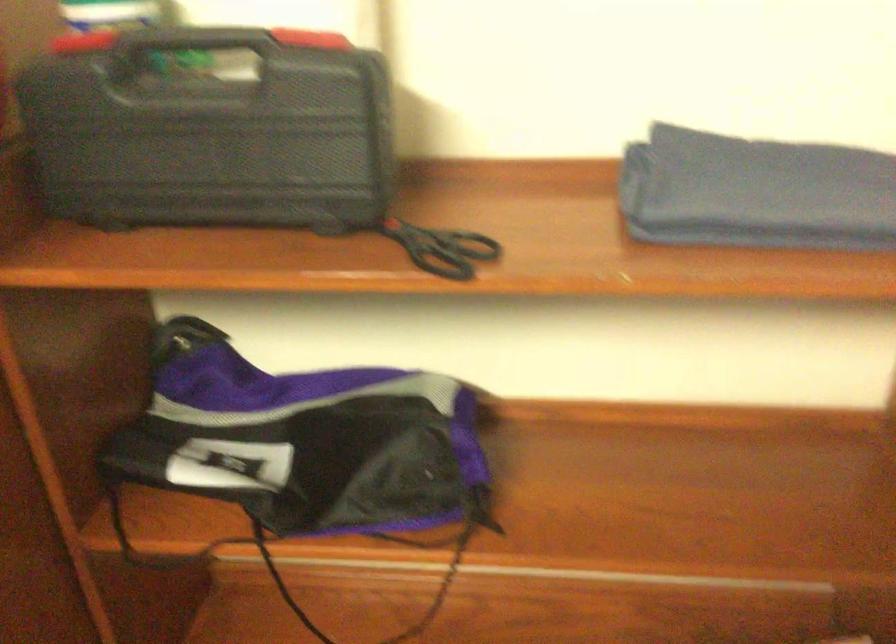
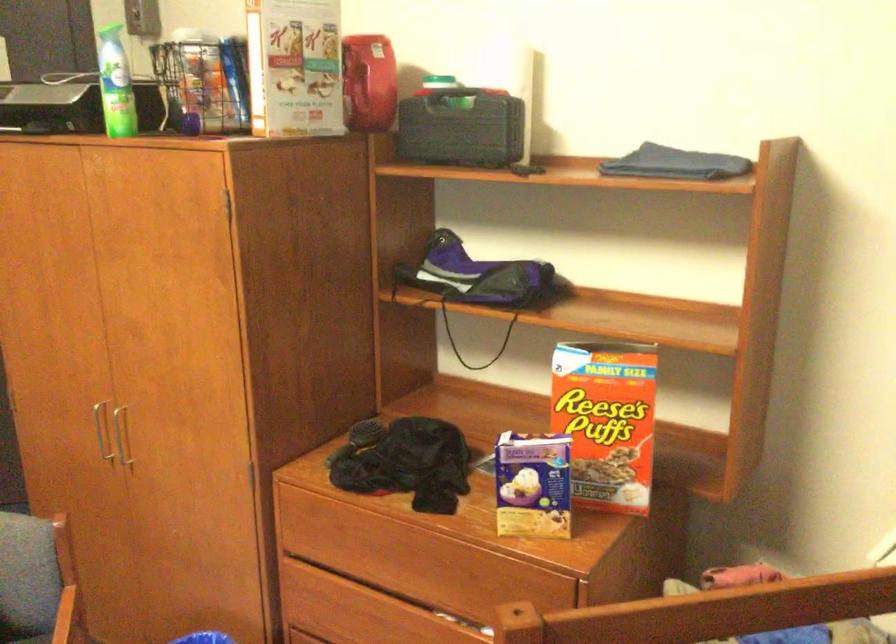
Locate, in the second image, the point that corresponds to point (243, 147) in the first image.

(461, 128)